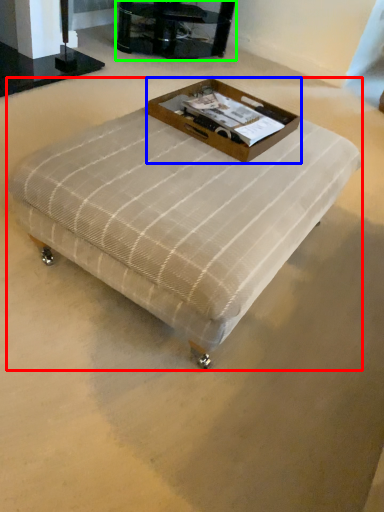
Question: Considering the real-world distances, which object is farthest from table (highlighted by a red box)? box (highlighted by a blue box) or furniture (highlighted by a green box)?

Choices:
 (A) box
 (B) furniture

Answer: (B)